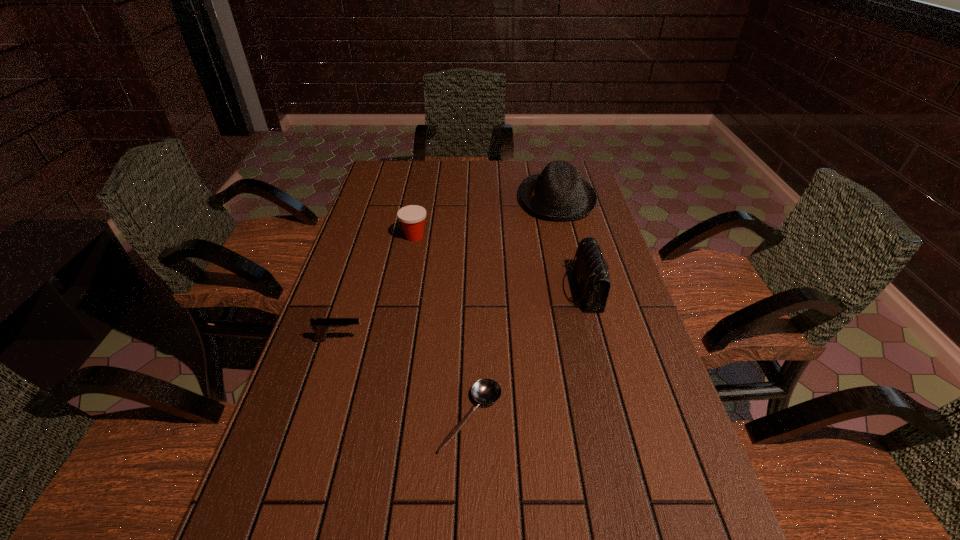
I want to click on vacant space located 0.290m on the front-facing side of the fedora, so click(437, 200).

Identify the location of free space located on the front flap of the third farthest object. (461, 290).

You are a GUI agent. You are given a task and a screenshot of the screen. Output one action in this format:
    pyautogui.click(x=<x>, y=<y>)
    Task: Click on the free space located 0.400m on the front flap of the third farthest object
    
    Given the screenshot: What is the action you would take?
    pyautogui.click(x=417, y=290)

Image resolution: width=960 pixels, height=540 pixels. In order to click on free point located 0.340m on the front flap of the third farthest object in this screenshot , I will do `click(439, 290)`.

You are a GUI agent. You are given a task and a screenshot of the screen. Output one action in this format:
    pyautogui.click(x=<x>, y=<y>)
    Task: Click on the free spot located 0.350m on the back of the third shortest object
    The height and width of the screenshot is (540, 960).
    Given the screenshot: What is the action you would take?
    pyautogui.click(x=426, y=177)

Where is `free region located 0.140m at the muzzle of the leftmost object`? The image size is (960, 540). free region located 0.140m at the muzzle of the leftmost object is located at coordinates (422, 340).

What are the coordinates of `vacant space located 0.190m on the left of the shortest object` in the screenshot? It's located at (348, 417).

This screenshot has width=960, height=540. In order to click on object located at the far edge in this screenshot , I will do `click(559, 193)`.

Locate an element on the screen. The height and width of the screenshot is (540, 960). Dixie cup that is at the left edge is located at coordinates (412, 217).

Where is `pistol positioned at the left edge`? This screenshot has width=960, height=540. pistol positioned at the left edge is located at coordinates (320, 325).